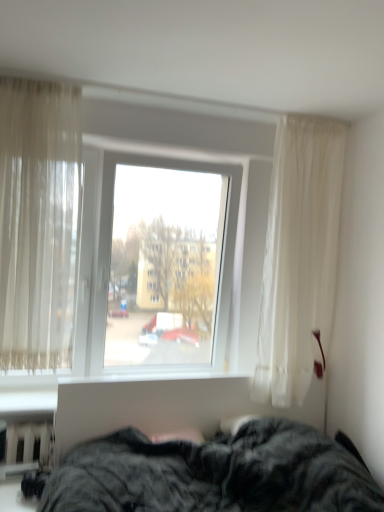
Question: Is point (11, 349) closer or farther from the camera than point (48, 448)?

Choices:
 (A) closer
 (B) farther

Answer: (A)

Question: Is sheer beige curtain at left bigger or smaller than white plastic radiator at lower left?

Choices:
 (A) small
 (B) big

Answer: (B)

Question: Estimate the real-world distances between objects in this image. Which object is farther from the white plastic radiator at lower left?

Choices:
 (A) dark gray plush bed at lower center
 (B) sheer beige curtain at left
 (C) transparent glass window at center

Answer: (C)

Question: Which object is positioned closest to the dark gray plush bed at lower center?

Choices:
 (A) transparent glass window at center
 (B) sheer beige curtain at left
 (C) white plastic radiator at lower left

Answer: (C)